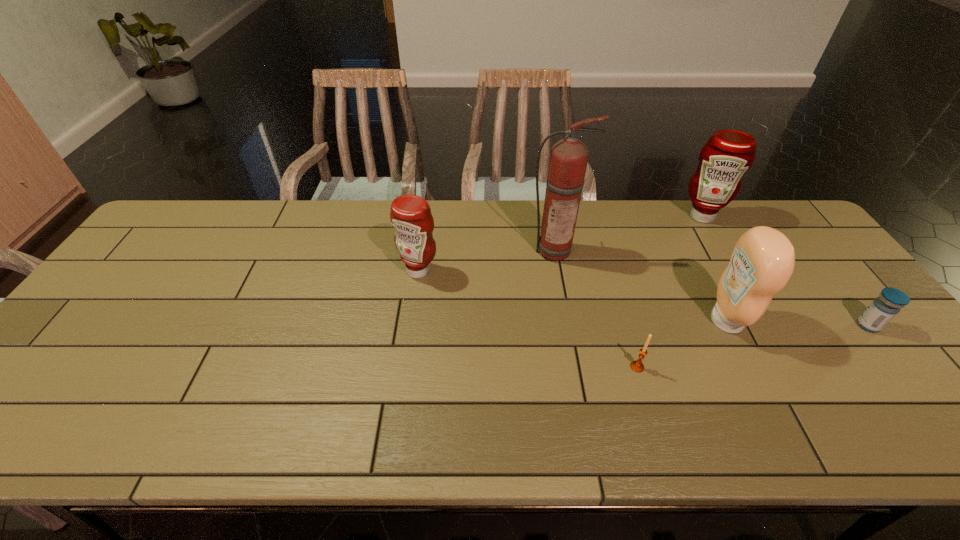
At what (x,y) coordinates should I click in order to perform the action: click on empty location between the rightmost object and the third shortest object. Please return your answer as a coordinate pair (x, y). Looking at the image, I should click on (643, 298).

The width and height of the screenshot is (960, 540). I want to click on vacant space that is in between the rightmost object and the candle_holder, so click(x=753, y=346).

Where is `object that is the third closest one to the fire extinguisher`? This screenshot has width=960, height=540. object that is the third closest one to the fire extinguisher is located at coordinates 637,365.

Choose which object is the fourth nearest neighbor to the medicine. Please provide its 2D coordinates. Your answer should be formatted as a tuple, i.e. [(x, y)], where the tuple contains the x and y coordinates of a point satisfying the conditions above.

[(568, 160)]

The height and width of the screenshot is (540, 960). Find the location of `condiment that is the second closest to the nearest condiment`. condiment that is the second closest to the nearest condiment is located at coordinates (410, 215).

The width and height of the screenshot is (960, 540). I want to click on condiment that can be found as the closest to the nearest condiment, so click(x=726, y=156).

Locate an element on the screen. The image size is (960, 540). vacant space that satisfies the following two spatial constraints: 1. on the back side of the candle_holder; 2. on the right side of the farthest object is located at coordinates (592, 216).

Where is `free space in the image that satisfies the following two spatial constraints: 1. on the back side of the farthest condiment; 2. on the right side of the second nearest condiment`? The width and height of the screenshot is (960, 540). free space in the image that satisfies the following two spatial constraints: 1. on the back side of the farthest condiment; 2. on the right side of the second nearest condiment is located at coordinates (426, 216).

Locate an element on the screen. The width and height of the screenshot is (960, 540). vacant region that satisfies the following two spatial constraints: 1. on the label of the nearest condiment; 2. on the left side of the medicine is located at coordinates (729, 326).

The width and height of the screenshot is (960, 540). Find the location of `free location that satisfies the following two spatial constraints: 1. on the side of the tallest object with the label and nozzle; 2. on the left side of the candle_holder`. free location that satisfies the following two spatial constraints: 1. on the side of the tallest object with the label and nozzle; 2. on the left side of the candle_holder is located at coordinates (575, 367).